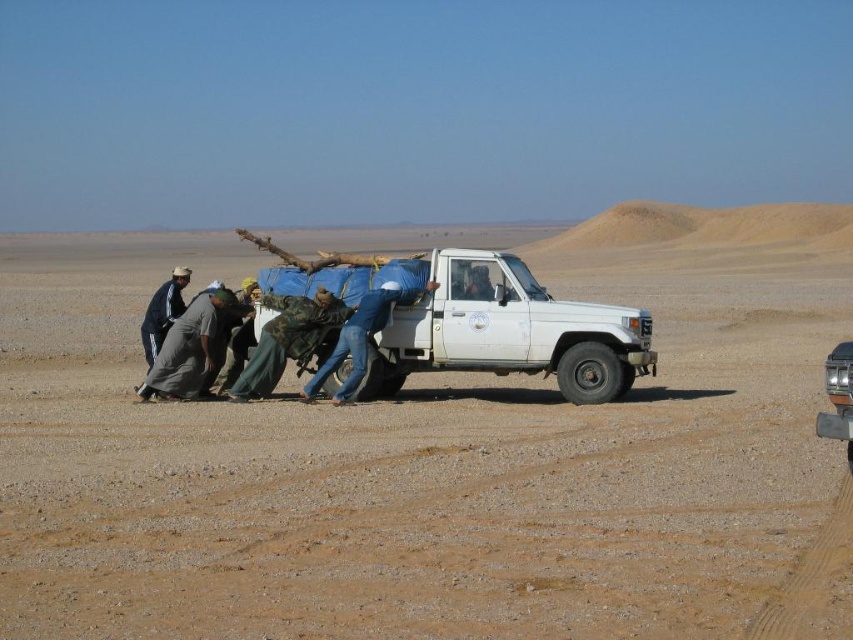
From the picture: Can you confirm if gray fabric clothing at lower left is positioned above matte blue jeans at center?

No, gray fabric clothing at lower left is not above matte blue jeans at center.

Between point (186, 384) and point (489, 296), which one is positioned in front?

Point (186, 384) is in front.

Locate an element on the screen. Image resolution: width=853 pixels, height=640 pixels. gray fabric clothing at lower left is located at coordinates (194, 346).

Does brown sandy dirt at center appear over matte blue jeans at center?

Incorrect, brown sandy dirt at center is not positioned above matte blue jeans at center.

Can you confirm if brown sandy dirt at center is bigger than matte blue jeans at center?

Indeed, brown sandy dirt at center has a larger size compared to matte blue jeans at center.

The image size is (853, 640). I want to click on brown sandy dirt at center, so click(422, 472).

Consider the image. Does gray fabric clothing at lower left appear on the right side of camouflage fabric pants at center?

In fact, gray fabric clothing at lower left is to the left of camouflage fabric pants at center.

Which is more to the right, gray fabric clothing at lower left or camouflage fabric pants at center?

Positioned to the right is camouflage fabric pants at center.

At what (x,y) coordinates should I click in order to perform the action: click on gray fabric clothing at lower left. Please return your answer as a coordinate pair (x, y). Looking at the image, I should click on (194, 346).

At what (x,y) coordinates should I click in order to perform the action: click on gray fabric clothing at lower left. Please return your answer as a coordinate pair (x, y). Looking at the image, I should click on (194, 346).